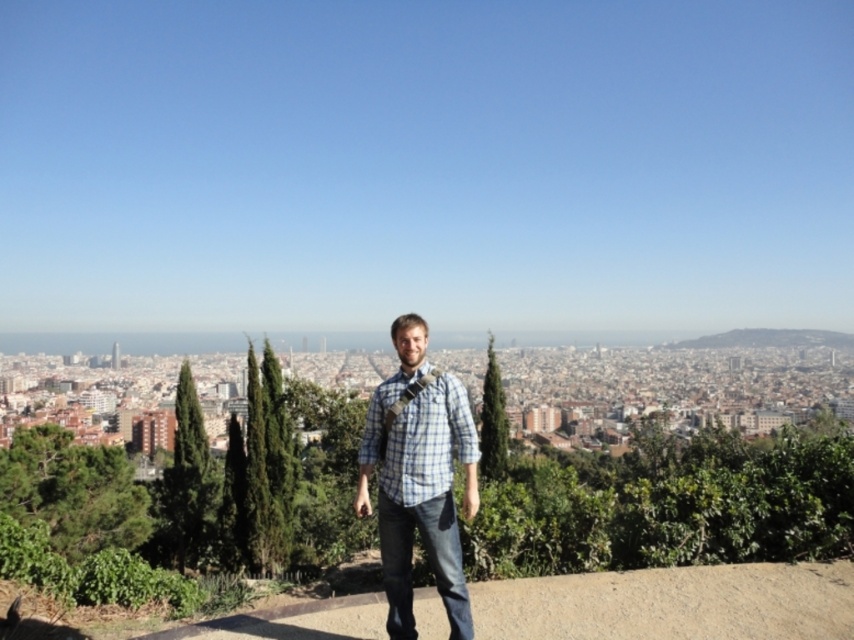
Question: Which point is closer to the camera taking this photo?

Choices:
 (A) pos(465,637)
 (B) pos(392,435)

Answer: (A)

Question: Does blue plaid shirt at center appear on the left side of plaid fabric shirt at center?

Choices:
 (A) no
 (B) yes

Answer: (B)

Question: Observing the image, what is the correct spatial positioning of blue plaid shirt at center in reference to plaid fabric shirt at center?

Choices:
 (A) above
 (B) below

Answer: (B)

Question: Can you confirm if blue plaid shirt at center is thinner than plaid fabric shirt at center?

Choices:
 (A) no
 (B) yes

Answer: (A)